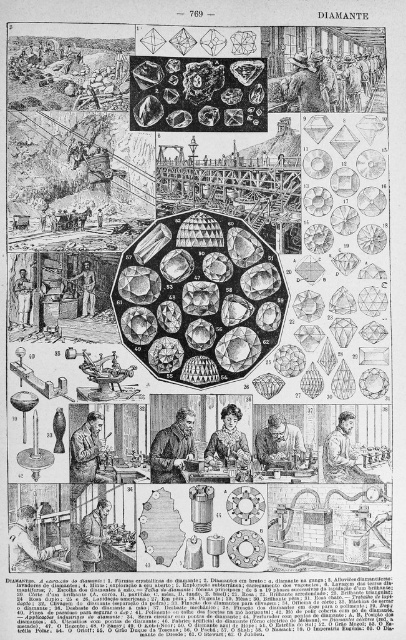
Imagine you are looking at the illustration of diamond mining processes. There are two points marked in the image, one at point (274, 452) and another at point (25, 288). Which point is closer to your view?

Point (274, 452) is in front of point (25, 288), so it is closer to your view.

You are an artist preparing to sketch this image. You need to ensure that the brown leather jacket at lower left and the wooden figure at center are proportionally accurate. Based on the description, which object should you draw wider?

The brown leather jacket at lower left should be drawn wider than the wooden figure at center because its width surpasses the wooden figure at center.